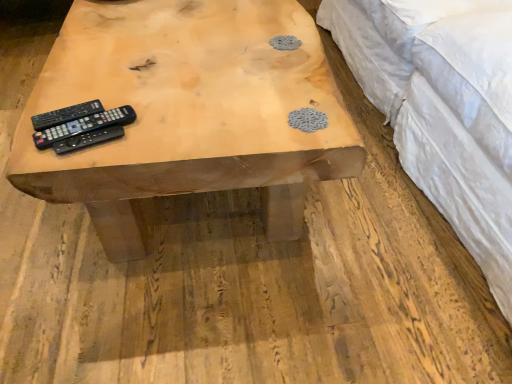
Describe the element at coordinates (187, 112) in the screenshot. I see `natural wood table at center` at that location.

Where is `black plastic remote at left, which ranks as the 2th remote control in back-to-front order`? black plastic remote at left, which ranks as the 2th remote control in back-to-front order is located at coordinates (84, 126).

Is black plastic remote at left, which ranks as the 2th remote control in front-to-back order, thinner than white quilted fabric at upper right?

Indeed, black plastic remote at left, which ranks as the 2th remote control in front-to-back order, has a lesser width compared to white quilted fabric at upper right.

Considering the sizes of objects black plastic remote at left, which ranks as the 2th remote control in back-to-front order, and white quilted fabric at upper right in the image provided, who is taller, black plastic remote at left, which ranks as the 2th remote control in back-to-front order, or white quilted fabric at upper right?

white quilted fabric at upper right.

Which is correct: black plastic remote at left, which ranks as the 2th remote control in front-to-back order, is inside white quilted fabric at upper right, or outside of it?

black plastic remote at left, which ranks as the 2th remote control in front-to-back order, lies outside white quilted fabric at upper right.

Does black plastic remote at left, which ranks as the 2th remote control in front-to-back order, touch white quilted fabric at upper right?

No, black plastic remote at left, which ranks as the 2th remote control in front-to-back order, is not making contact with white quilted fabric at upper right.

Which object is more forward, natural wood table at center or black matte remote control at left, which is the first remote control from back to front?

natural wood table at center is in front.

Considering the relative positions of natural wood table at center and black matte remote control at left, the 3th remote control from the front, in the image provided, is natural wood table at center to the right of black matte remote control at left, the 3th remote control from the front, from the viewer's perspective?

Yes, natural wood table at center is to the right of black matte remote control at left, the 3th remote control from the front.

Is point (160, 53) less distant than point (68, 116)?

No, it is behind (68, 116).

Considering the sizes of objects natural wood table at center and black matte remote control at left, which is the first remote control from back to front, in the image provided, who is bigger, natural wood table at center or black matte remote control at left, which is the first remote control from back to front,?

natural wood table at center.

Is white quilted fabric at upper right far from black matte remote control at center, which appears as the first remote control when viewed from the front?

No.

Does white quilted fabric at upper right appear on the right side of black matte remote control at center, which appears as the first remote control when viewed from the front?

Correct, you'll find white quilted fabric at upper right to the right of black matte remote control at center, which appears as the first remote control when viewed from the front.

Which point is more forward, (471, 12) or (62, 141)?

The point (62, 141) is closer.

From a real-world perspective, between white quilted fabric at upper right and black matte remote control at center, which appears as the first remote control when viewed from the front, who is vertically lower?

white quilted fabric at upper right.

Is white quilted fabric at upper right oriented away from black matte remote control at left, the 3th remote control from the front?

white quilted fabric at upper right does not have its back to black matte remote control at left, the 3th remote control from the front.

From a real-world perspective, who is located lower, white quilted fabric at upper right or black matte remote control at left, which is the first remote control from back to front?

white quilted fabric at upper right is physically lower.

Can you confirm if white quilted fabric at upper right is positioned to the left of black matte remote control at left, the 3th remote control from the front?

In fact, white quilted fabric at upper right is to the right of black matte remote control at left, the 3th remote control from the front.

Is white quilted fabric at upper right touching black matte remote control at left, which is the first remote control from back to front?

white quilted fabric at upper right is not next to black matte remote control at left, which is the first remote control from back to front, and they're not touching.

Is black plastic remote at left, which ranks as the 2th remote control in front-to-back order, with black matte remote control at center, which appears as the first remote control when viewed from the front?

Yes, black plastic remote at left, which ranks as the 2th remote control in front-to-back order, is with black matte remote control at center, which appears as the first remote control when viewed from the front.

Considering the relative positions of black plastic remote at left, which ranks as the 2th remote control in back-to-front order, and black matte remote control at center, which appears as the first remote control when viewed from the front, in the image provided, is black plastic remote at left, which ranks as the 2th remote control in back-to-front order, to the left or to the right of black matte remote control at center, which appears as the first remote control when viewed from the front,?

Based on their positions, black plastic remote at left, which ranks as the 2th remote control in back-to-front order, is located to the left of black matte remote control at center, which appears as the first remote control when viewed from the front.

Considering the relative sizes of black plastic remote at left, which ranks as the 2th remote control in back-to-front order, and black matte remote control at center, which appears as the first remote control when viewed from the front, in the image provided, is black plastic remote at left, which ranks as the 2th remote control in back-to-front order, wider than black matte remote control at center, which appears as the first remote control when viewed from the front,?

Correct, the width of black plastic remote at left, which ranks as the 2th remote control in back-to-front order, exceeds that of black matte remote control at center, which appears as the first remote control when viewed from the front.

Looking at this image, can you confirm if black plastic remote at left, which ranks as the 2th remote control in front-to-back order, is taller than black matte remote control at center, which is the third remote control from back to front?

No.

Which is correct: black plastic remote at left, which ranks as the 2th remote control in back-to-front order, is inside black matte remote control at left, the 3th remote control from the front, or outside of it?

The correct answer is: outside.

Between black plastic remote at left, which ranks as the 2th remote control in back-to-front order, and black matte remote control at left, the 3th remote control from the front, which one has smaller width?

black matte remote control at left, the 3th remote control from the front, is thinner.

Based on the photo, does black plastic remote at left, which ranks as the 2th remote control in front-to-back order, have a greater height compared to black matte remote control at left, the 3th remote control from the front?

Incorrect, the height of black plastic remote at left, which ranks as the 2th remote control in front-to-back order, is not larger of that of black matte remote control at left, the 3th remote control from the front.

Considering the sizes of black matte remote control at left, which is the first remote control from back to front, and white quilted fabric at upper right in the image, is black matte remote control at left, which is the first remote control from back to front, bigger or smaller than white quilted fabric at upper right?

Clearly, black matte remote control at left, which is the first remote control from back to front, is smaller in size than white quilted fabric at upper right.

Identify the location of bed above the black matte remote control at left, which is the first remote control from back to front (from the image's perspective). The image size is (512, 384). (443, 108).

Is black matte remote control at left, which is the first remote control from back to front, oriented towards white quilted fabric at upper right?

No, black matte remote control at left, which is the first remote control from back to front, does not turn towards white quilted fabric at upper right.

Would you say black matte remote control at left, which is the first remote control from back to front, is to the left or to the right of white quilted fabric at upper right in the picture?

black matte remote control at left, which is the first remote control from back to front, is to the left of white quilted fabric at upper right.

Which remote control is the 2nd one when counting from the back of the white quilted fabric at upper right? Please provide its 2D coordinates.

[(84, 126)]

At what (x,y) coordinates should I click in order to perform the action: click on the 2nd remote control above the natural wood table at center (from a real-world perspective). Please return your answer as a coordinate pair (x, y). This screenshot has height=384, width=512. Looking at the image, I should click on (66, 115).

Based on their spatial positions, is black plastic remote at left, which ranks as the 2th remote control in back-to-front order, or natural wood table at center further from white quilted fabric at upper right?

The object further to white quilted fabric at upper right is black plastic remote at left, which ranks as the 2th remote control in back-to-front order.

Estimate the real-world distances between objects in this image. Which object is closer to black matte remote control at left, the 3th remote control from the front, white quilted fabric at upper right or black plastic remote at left, which ranks as the 2th remote control in front-to-back order?

Among the two, black plastic remote at left, which ranks as the 2th remote control in front-to-back order, is located nearer to black matte remote control at left, the 3th remote control from the front.

From the picture: Considering their positions, is white quilted fabric at upper right positioned closer to black matte remote control at left, which is the first remote control from back to front, than natural wood table at center?

Based on the image, natural wood table at center appears to be nearer to black matte remote control at left, which is the first remote control from back to front.

Looking at the image, which one is located closer to white quilted fabric at upper right, black plastic remote at left, which ranks as the 2th remote control in front-to-back order, or black matte remote control at left, the 3th remote control from the front?

black plastic remote at left, which ranks as the 2th remote control in front-to-back order, lies closer to white quilted fabric at upper right than the other object.

From the image, which object appears to be nearer to black plastic remote at left, which ranks as the 2th remote control in back-to-front order, white quilted fabric at upper right or black matte remote control at left, which is the first remote control from back to front?

Among the two, black matte remote control at left, which is the first remote control from back to front, is located nearer to black plastic remote at left, which ranks as the 2th remote control in back-to-front order.

Based on their spatial positions, is black matte remote control at left, the 3th remote control from the front, or natural wood table at center further from black plastic remote at left, which ranks as the 2th remote control in back-to-front order?

natural wood table at center is positioned further to the anchor black plastic remote at left, which ranks as the 2th remote control in back-to-front order.

From the image, which object appears to be nearer to white quilted fabric at upper right, natural wood table at center or black matte remote control at left, which is the first remote control from back to front?

natural wood table at center lies closer to white quilted fabric at upper right than the other object.

Considering their positions, is black matte remote control at left, which is the first remote control from back to front, positioned closer to natural wood table at center than black matte remote control at center, which appears as the first remote control when viewed from the front?

The object closer to natural wood table at center is black matte remote control at left, which is the first remote control from back to front.

Locate an element on the screen. table situated between black matte remote control at center, which appears as the first remote control when viewed from the front, and white quilted fabric at upper right from left to right is located at coordinates (187, 112).

At what (x,y) coordinates should I click in order to perform the action: click on remote control between black matte remote control at left, the 3th remote control from the front, and black matte remote control at center, which appears as the first remote control when viewed from the front, from left to right. Please return your answer as a coordinate pair (x, y). The image size is (512, 384). Looking at the image, I should click on [84, 126].

The width and height of the screenshot is (512, 384). Find the location of `table situated between black plastic remote at left, which ranks as the 2th remote control in front-to-back order, and white quilted fabric at upper right from left to right`. table situated between black plastic remote at left, which ranks as the 2th remote control in front-to-back order, and white quilted fabric at upper right from left to right is located at coordinates (187, 112).

At what (x,y) coordinates should I click in order to perform the action: click on remote control located between black plastic remote at left, which ranks as the 2th remote control in front-to-back order, and white quilted fabric at upper right in the left-right direction. Please return your answer as a coordinate pair (x, y). Looking at the image, I should click on (88, 139).